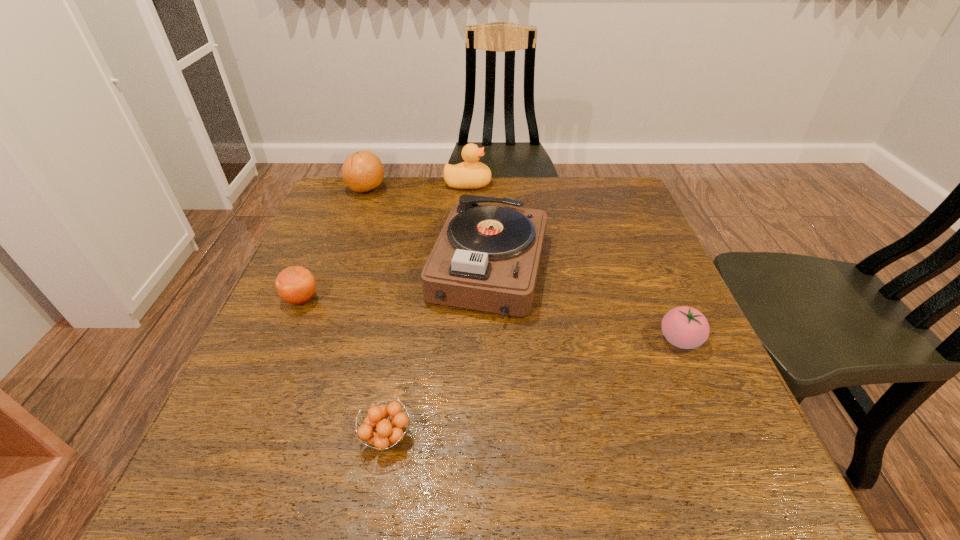
The image size is (960, 540). Find the location of `free location at the left edge`. free location at the left edge is located at coordinates [x=296, y=321].

At what (x,y) coordinates should I click in order to perform the action: click on blank space at the right edge of the desktop. Please return your answer as a coordinate pair (x, y). Looking at the image, I should click on (622, 259).

This screenshot has width=960, height=540. Find the location of `vacant space at the near right corner of the desktop`. vacant space at the near right corner of the desktop is located at coordinates (765, 501).

The width and height of the screenshot is (960, 540). Identify the location of vacant space that's between the second nearest orange fruit and the shortest orange fruit. (344, 368).

The height and width of the screenshot is (540, 960). In order to click on free point between the duck and the second nearest orange fruit in this screenshot , I will do `click(385, 241)`.

Image resolution: width=960 pixels, height=540 pixels. Find the location of `free spot between the record player and the shortest object`. free spot between the record player and the shortest object is located at coordinates (438, 353).

Identify the location of free space between the shortest object and the second shortest orange fruit. (344, 368).

Locate an element on the screen. unoccupied position between the tallest orange fruit and the record player is located at coordinates (427, 229).

The width and height of the screenshot is (960, 540). Find the location of `vacant point located between the rightmost orange fruit and the rightmost object`. vacant point located between the rightmost orange fruit and the rightmost object is located at coordinates pyautogui.click(x=533, y=389).

I want to click on empty space between the rightmost orange fruit and the rightmost object, so click(533, 389).